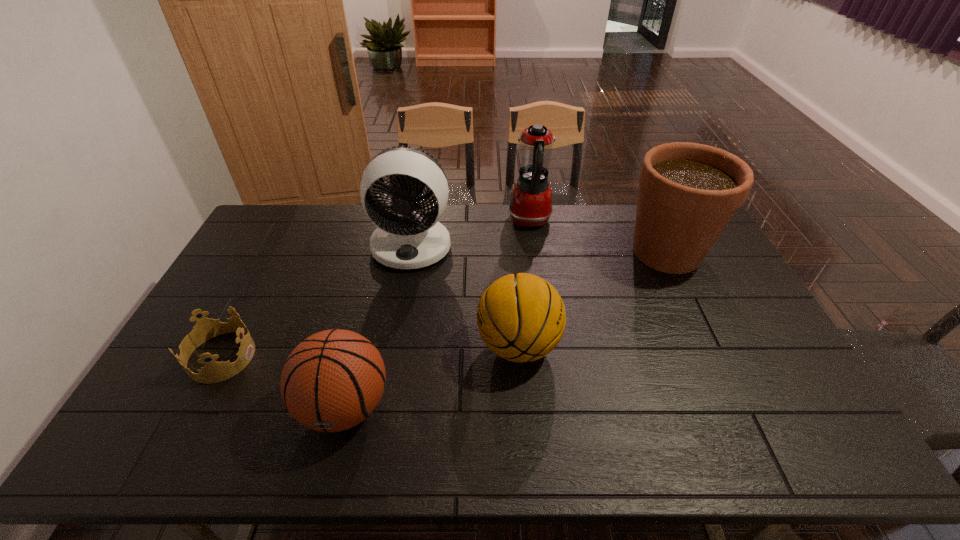
The width and height of the screenshot is (960, 540). Identify the location of free spot between the tiara and the fan. (317, 301).

You are a GUI agent. You are given a task and a screenshot of the screen. Output one action in this format:
    pyautogui.click(x=<x>, y=<y>)
    Task: Click on the free spot between the fan and the rightmost object
    This screenshot has height=540, width=960.
    Given the screenshot: What is the action you would take?
    pyautogui.click(x=540, y=249)

This screenshot has height=540, width=960. What are the coordinates of `unoccupied area between the rightmost object and the food processor` in the screenshot? It's located at (598, 236).

Identify the location of vacant point located between the tiara and the food processor. (375, 288).

Where is `unoccupied position between the right basketball and the left basketball`? The image size is (960, 540). unoccupied position between the right basketball and the left basketball is located at coordinates (432, 376).

Image resolution: width=960 pixels, height=540 pixels. I want to click on free space between the leftmost object and the fan, so click(x=317, y=301).

Locate an element on the screen. This screenshot has height=540, width=960. the closest object to the right basketball is located at coordinates (413, 239).

The height and width of the screenshot is (540, 960). I want to click on object that stands as the second closest to the flowerpot, so click(x=520, y=318).

Identify the location of vacant position in the image that satisfies the following two spatial constraints: 1. on the controls of the food processor; 2. on the side where the inflation valve is located. (556, 407).

In order to click on vacant space that satisfies the following two spatial constraints: 1. on the back side of the rightmost object; 2. on the controls of the food processor in this screenshot , I will do `click(651, 220)`.